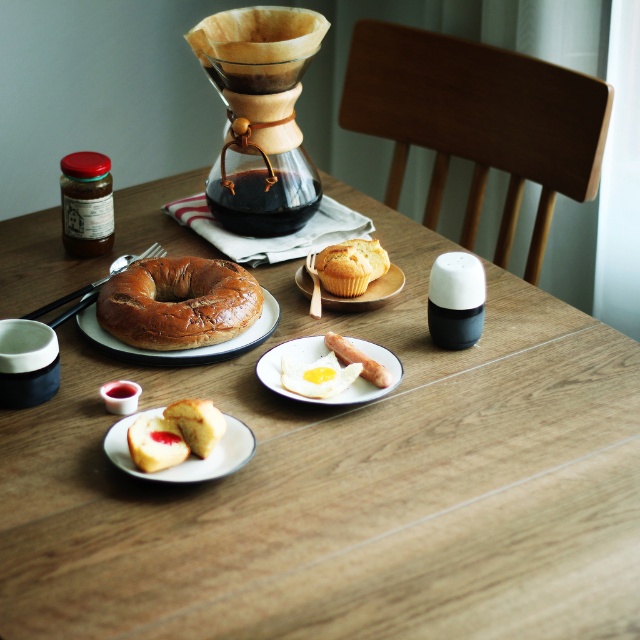
Question: Does smooth white egg at center have a smaller size compared to matte ceramic muffin at center?

Choices:
 (A) yes
 (B) no

Answer: (A)

Question: Which point is farther to the camera?

Choices:
 (A) baked golden-brown bagel at center
 (B) matte ceramic muffin at center

Answer: (B)

Question: Can you confirm if white ceramic plate at center is bigger than golden crumbly muffin at center?

Choices:
 (A) no
 (B) yes

Answer: (B)

Question: Which of the following is the closest to the observer?

Choices:
 (A) (211, 387)
 (B) (314, 266)
 (C) (157, 474)
 (D) (323, 360)

Answer: (C)

Question: Does baked golden-brown bagel at center appear under golden crumbly muffin at center?

Choices:
 (A) yes
 (B) no

Answer: (A)

Question: Which object appears closest to the camera in this image?

Choices:
 (A) smooth white egg at center
 (B) matte ceramic muffin at center
 (C) white ceramic plate at center

Answer: (C)